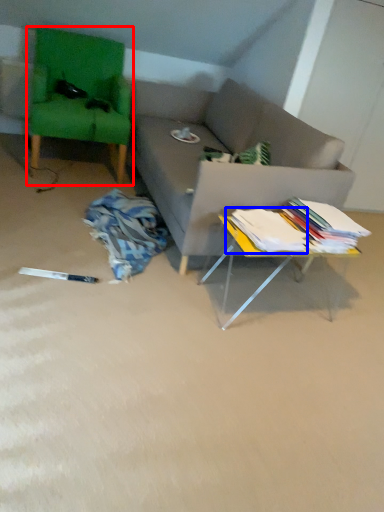
Question: Which object is further to the camera taking this photo, swivel chair (highlighted by a red box) or book (highlighted by a blue box)?

Choices:
 (A) swivel chair
 (B) book

Answer: (A)